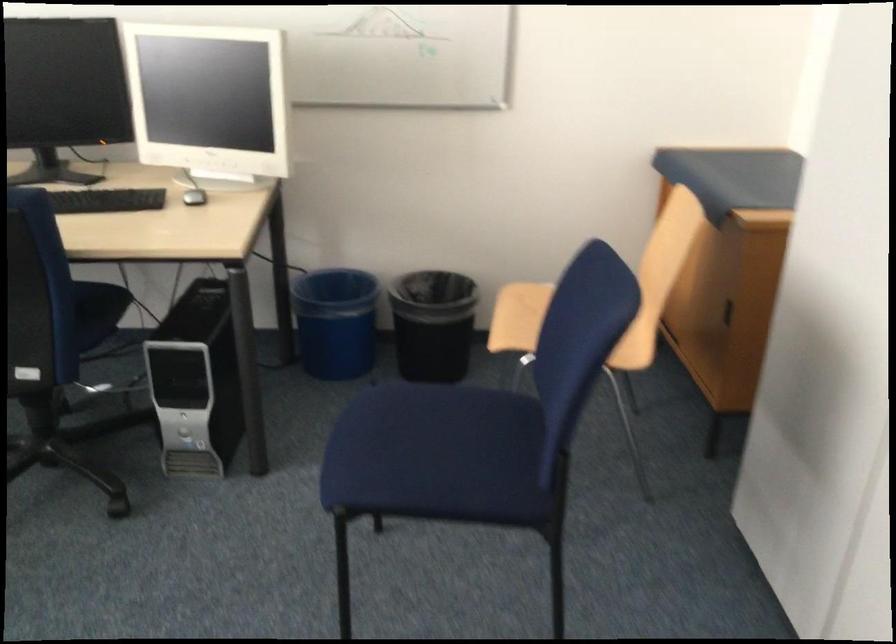
Question: The camera is either moving clockwise (left) or counter-clockwise (right) around the object. The first image is from the beginning of the video and the second image is from the end. Is the camera moving left or right when shooting the video?

Choices:
 (A) Left
 (B) Right

Answer: (B)